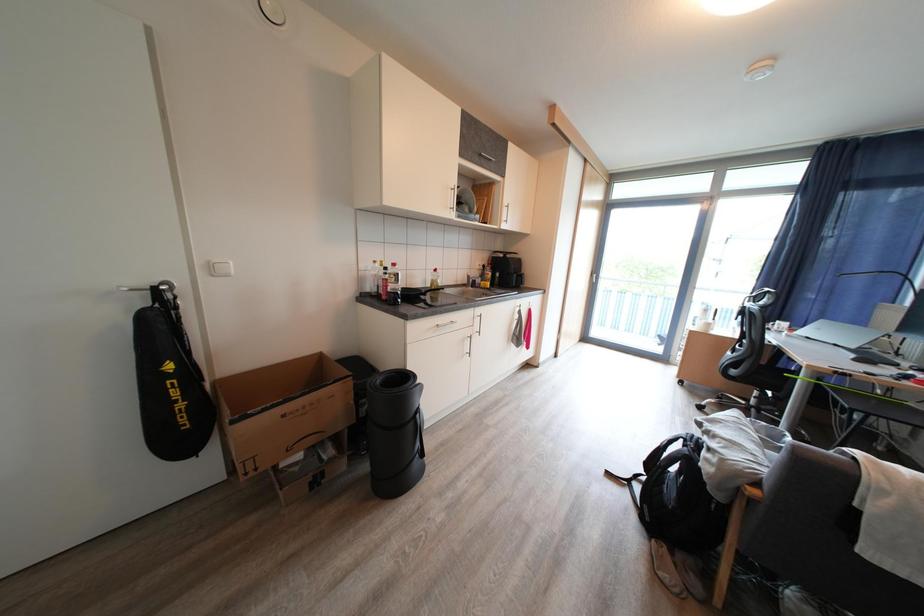
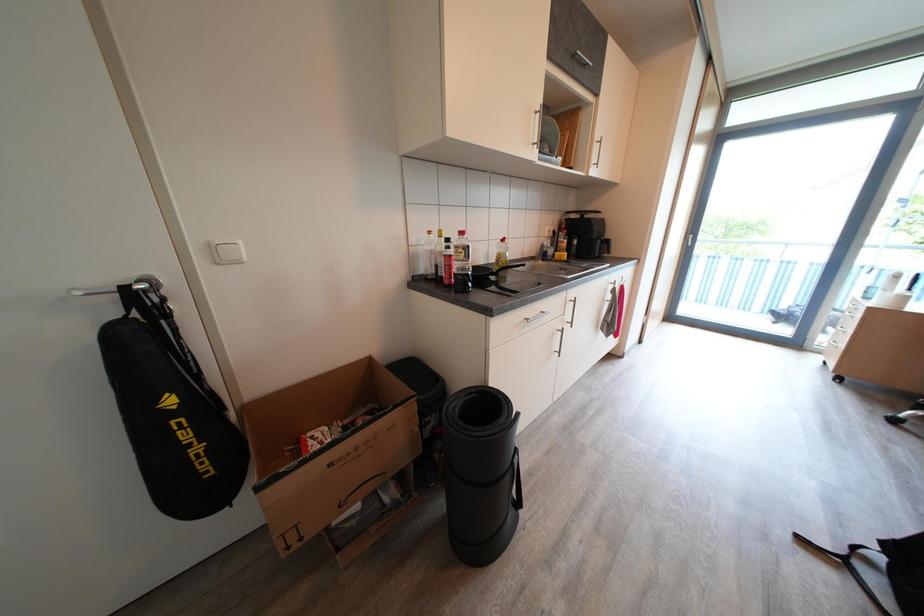
Question: Based on the continuous images, in which direction is the camera rotating? Reply with the corresponding letter.

Choices:
 (A) Left
 (B) Right
 (C) Up
 (D) Down

Answer: (A)